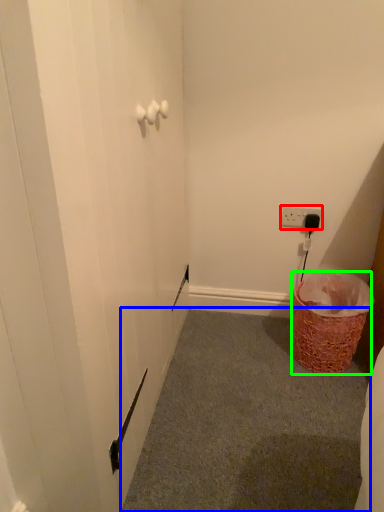
Question: Considering the real-world distances, which object is farthest from electric outlet (highlighted by a red box)? plain (highlighted by a blue box) or basket (highlighted by a green box)?

Choices:
 (A) plain
 (B) basket

Answer: (A)